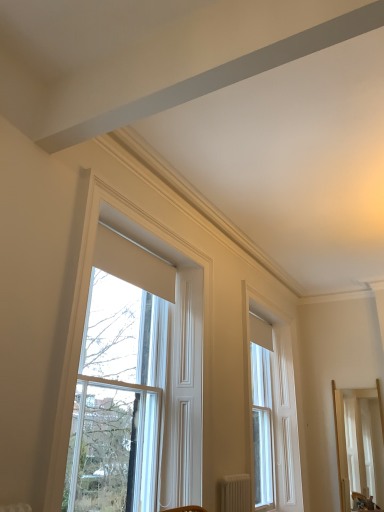
Question: Is light wood mirror at right at the right side of white wood window at center, positioned as the second window in left-to-right order?

Choices:
 (A) yes
 (B) no

Answer: (A)

Question: From the image's perspective, is light wood mirror at right under white wood window at center, positioned as the second window in left-to-right order?

Choices:
 (A) no
 (B) yes

Answer: (B)

Question: Is light wood mirror at right aimed at white wood window at center, the 1th window from the right?

Choices:
 (A) no
 (B) yes

Answer: (A)

Question: Is light wood mirror at right positioned behind white wood window at center, positioned as the second window in left-to-right order?

Choices:
 (A) yes
 (B) no

Answer: (A)

Question: Is white wood window at center, positioned as the second window in left-to-right order, completely or partially inside light wood mirror at right?

Choices:
 (A) no
 (B) yes

Answer: (A)

Question: In terms of width, does white wood window at center, acting as the 2th window starting from the front, look wider or thinner when compared to white matte radiator at lower center?

Choices:
 (A) thin
 (B) wide

Answer: (A)

Question: From their relative heights in the image, would you say white wood window at center, positioned as the second window in left-to-right order, is taller or shorter than white matte radiator at lower center?

Choices:
 (A) tall
 (B) short

Answer: (A)

Question: Would you say white wood window at center, the 1th window from the right, is inside or outside white matte radiator at lower center?

Choices:
 (A) outside
 (B) inside

Answer: (A)

Question: From a real-world perspective, relative to white matte radiator at lower center, is white wood window at center, the 1th window from the right, vertically above or below?

Choices:
 (A) above
 (B) below

Answer: (A)

Question: Is white matte radiator at lower center inside or outside of white wood window at center, positioned as the second window in left-to-right order?

Choices:
 (A) inside
 (B) outside

Answer: (B)

Question: Based on their sizes in the image, would you say white matte radiator at lower center is bigger or smaller than white wood window at center, which ranks as the first window in back-to-front order?

Choices:
 (A) big
 (B) small

Answer: (B)

Question: From the image's perspective, is white matte radiator at lower center above or below white wood window at center, acting as the 2th window starting from the front?

Choices:
 (A) above
 (B) below

Answer: (B)

Question: Considering the positions of point (238, 502) and point (253, 489), is point (238, 502) closer or farther from the camera than point (253, 489)?

Choices:
 (A) farther
 (B) closer

Answer: (B)

Question: Is light wood mirror at right to the left or to the right of white matte radiator at lower center in the image?

Choices:
 (A) left
 (B) right

Answer: (B)

Question: Is point (354, 454) positioned closer to the camera than point (225, 498)?

Choices:
 (A) closer
 (B) farther

Answer: (B)